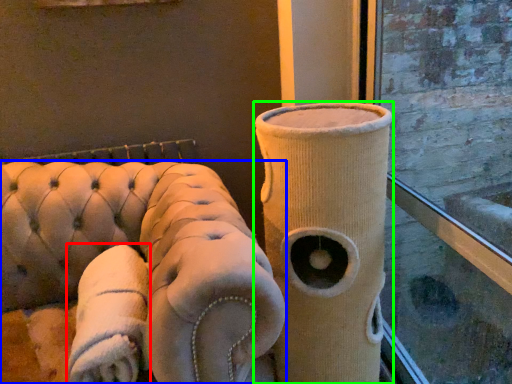
Question: Estimate the real-world distances between objects in this image. Which object is farther from cloth (highlighted by a red box), furniture (highlighted by a blue box) or vase (highlighted by a green box)?

Choices:
 (A) furniture
 (B) vase

Answer: (B)